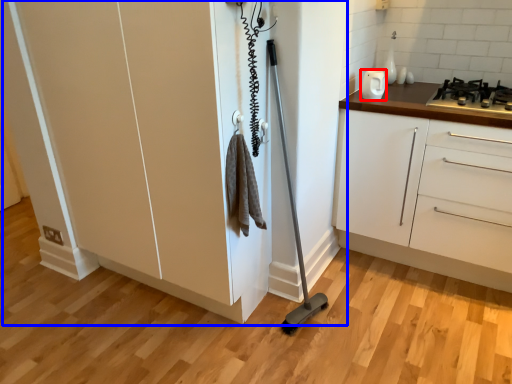
Question: Which of the following is the closest to the observer, home appliance (highlighted by a red box) or cupboard (highlighted by a blue box)?

Choices:
 (A) home appliance
 (B) cupboard

Answer: (B)